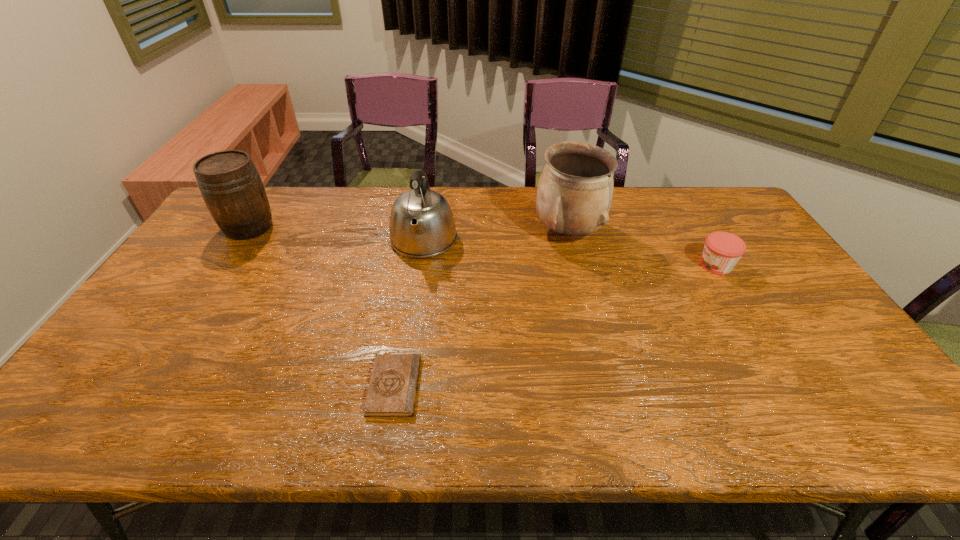
Locate an element on the screen. The height and width of the screenshot is (540, 960). free space between the fourth object from left to right and the rightmost object is located at coordinates (642, 249).

Identify the location of free space that is in between the jam and the leftmost object. The height and width of the screenshot is (540, 960). (483, 246).

The height and width of the screenshot is (540, 960). What are the coordinates of `empty location between the shortest object and the cider` in the screenshot? It's located at (322, 307).

This screenshot has height=540, width=960. In order to click on vacant space that is in between the leftmost object and the nearest object in this screenshot , I will do `click(322, 307)`.

Image resolution: width=960 pixels, height=540 pixels. I want to click on unoccupied position between the urn and the fourth tallest object, so click(x=642, y=249).

Find the location of a particular element. Image resolution: width=960 pixels, height=540 pixels. free space between the kettle and the urn is located at coordinates (496, 237).

I want to click on object that is the third closest one to the rightmost object, so click(x=392, y=391).

Locate an element on the screen. object that ranks as the second closest to the second object from right to left is located at coordinates (722, 250).

Identify the location of free space in the image that satisfies the following two spatial constraints: 1. on the side of the leftmost object near the bung hole; 2. on the left side of the urn. (246, 232).

Image resolution: width=960 pixels, height=540 pixels. In order to click on vacant space that satisfies the following two spatial constraints: 1. on the front side of the second object from right to left; 2. on the spine side of the nearest object in this screenshot , I will do `click(607, 386)`.